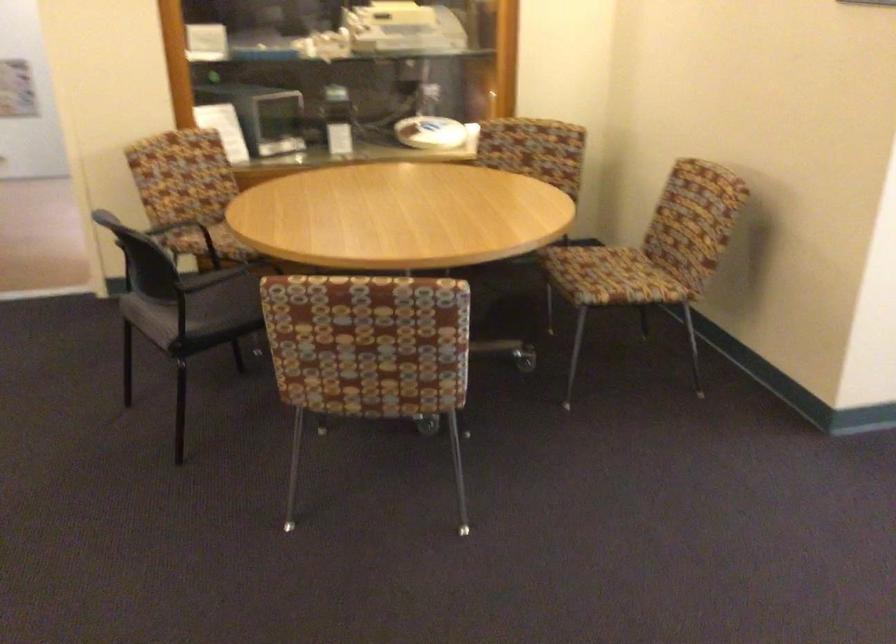
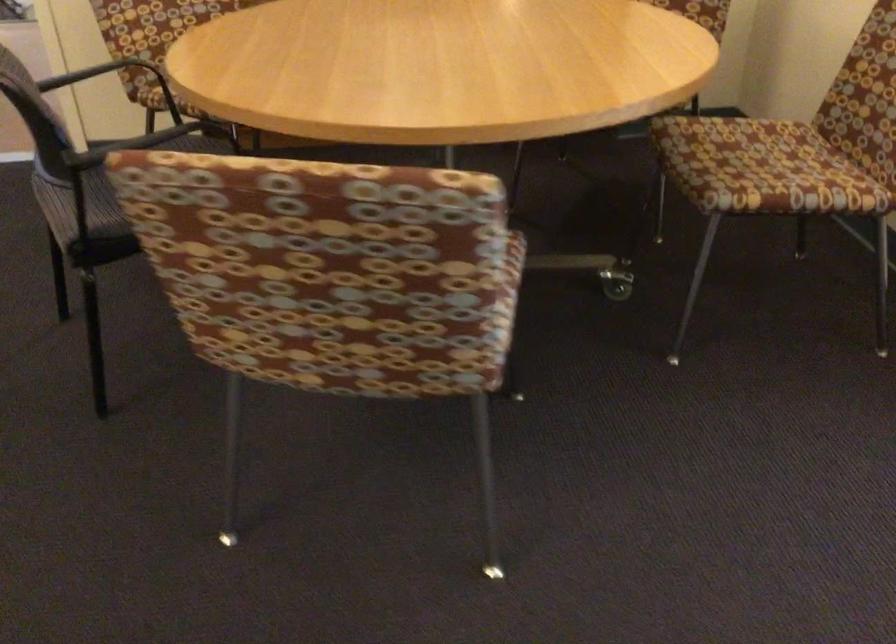
Find the pixel in the second image that matches pixel 616 285 in the first image.

(778, 187)